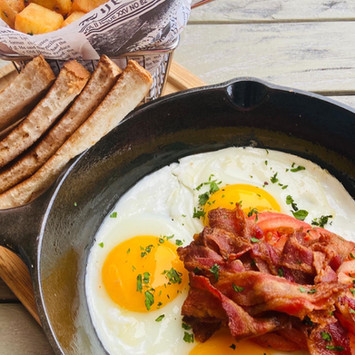
Locate an element on the screen. empty space on table is located at coordinates (292, 73).